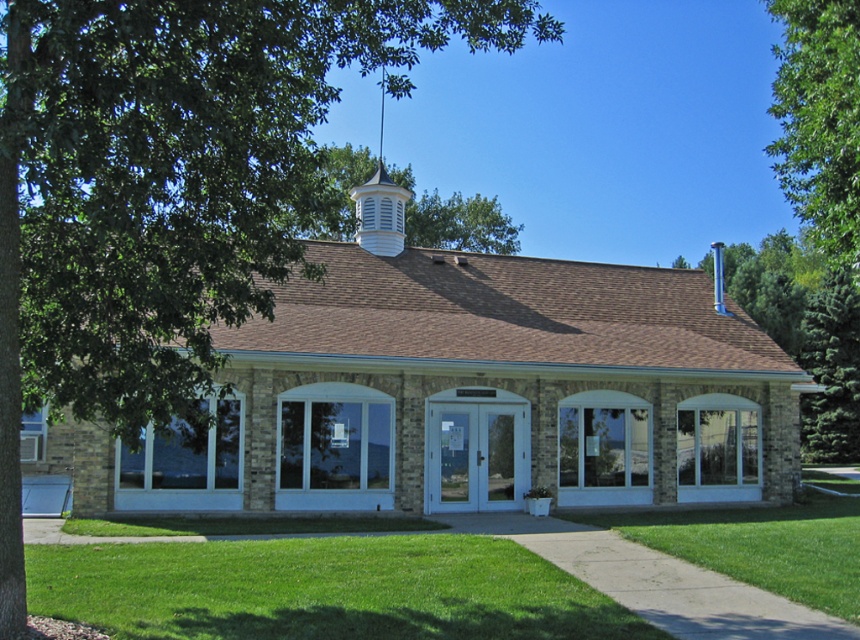
You are standing in front of the building and notice the green leafy tree at upper left. Based on its position, can you determine if the tree is closer to the left side or the right side of the building?

The green leafy tree at upper left is located at point (169, 189), which places it closer to the left side of the building.

You are standing in front of the building and want to take a photo. You notice two points marked on the building facade. The first point is at coordinates point (120, 300) and the second at point (164, 596). Which of these points appears closer to you in the photo?

Point (120, 300) is closer to the camera than point (164, 596), so it will appear closer in the photo.